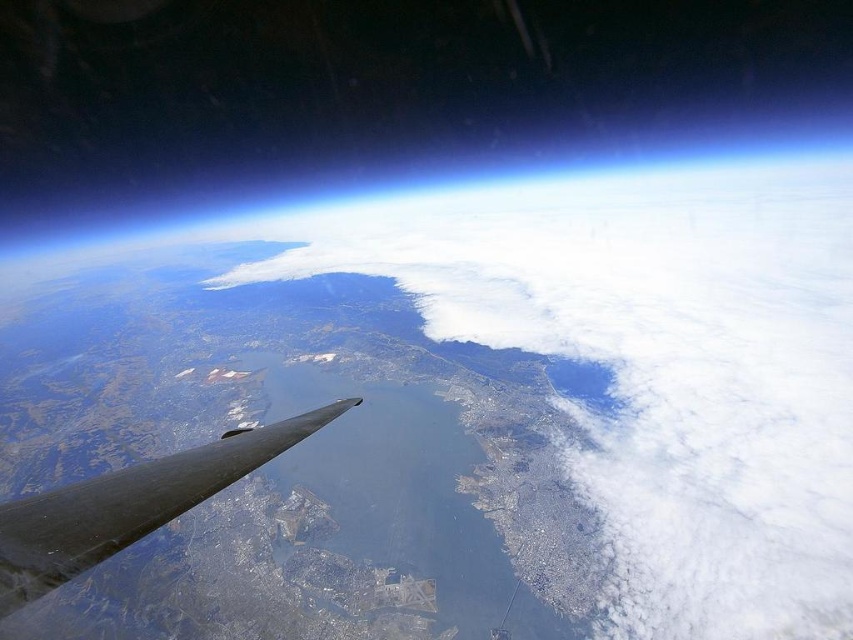
Is white fluffy cloud at center thinner than shiny metallic wing at lower left?

→ Incorrect, white fluffy cloud at center's width is not less than shiny metallic wing at lower left's.

Is point (593, 323) closer to camera compared to point (223, 468)?

No.

Where is `white fluffy cloud at center`? white fluffy cloud at center is located at coordinates (657, 364).